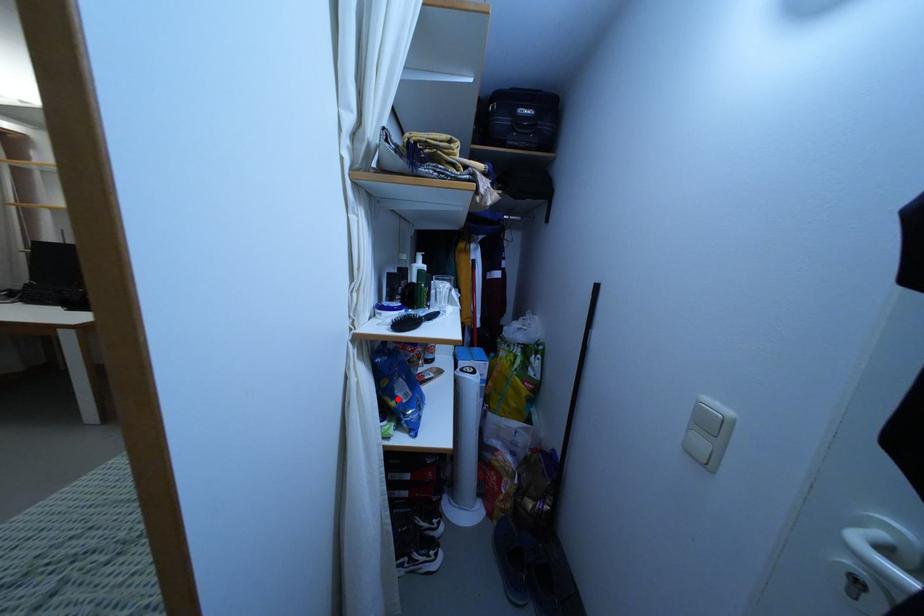
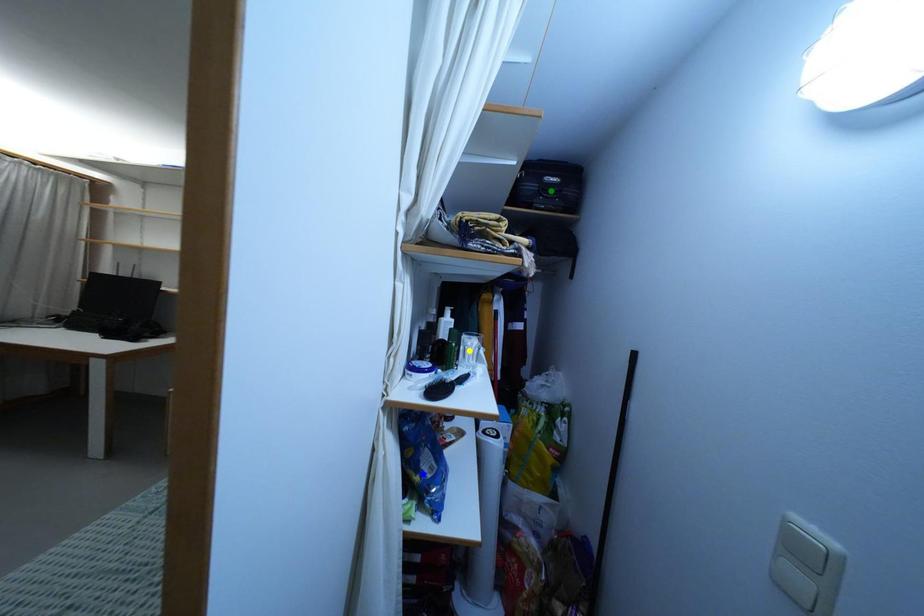
Question: I am providing you with two images of the same scene from different viewpoints. A red point is marked on the first image. You are given multiple points on the second image. Which spot in image 2 lines up with the point in image 1?

Choices:
 (A) blue point
 (B) green point
 (C) yellow point

Answer: (A)